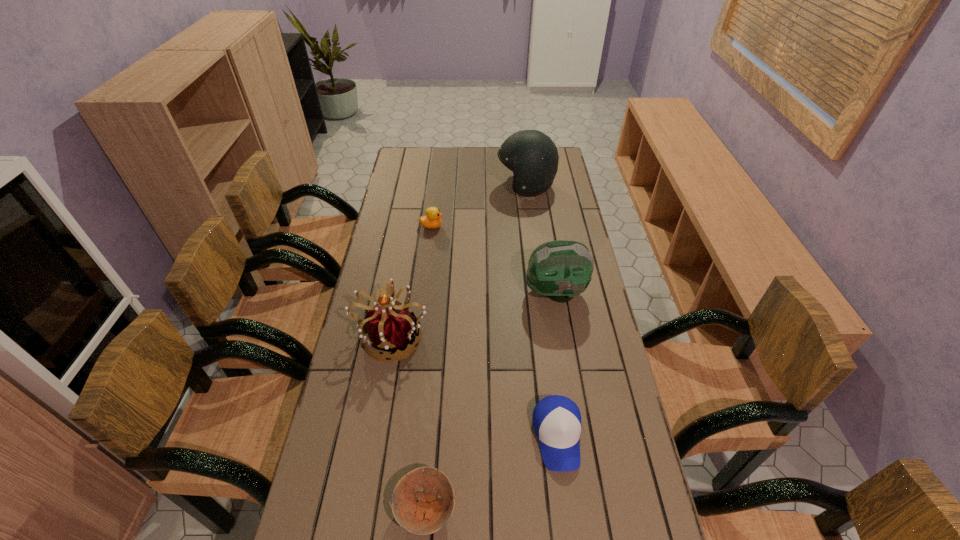
Locate an element on the screen. Image resolution: width=960 pixels, height=540 pixels. vacant region at the far edge of the desktop is located at coordinates (495, 164).

Locate an element on the screen. The image size is (960, 540). blank space at the left edge of the desktop is located at coordinates (375, 280).

Locate an element on the screen. Image resolution: width=960 pixels, height=540 pixels. vacant space at the right edge of the desktop is located at coordinates (553, 211).

Locate an element on the screen. empty space that is in between the tiara and the taller football helmet is located at coordinates (459, 261).

This screenshot has width=960, height=540. Find the location of `vacant point located between the farthest object and the second nearest object`. vacant point located between the farthest object and the second nearest object is located at coordinates (541, 311).

Where is `free spot between the baseball cap and the fifth nearest object`? The image size is (960, 540). free spot between the baseball cap and the fifth nearest object is located at coordinates (494, 332).

The width and height of the screenshot is (960, 540). In order to click on unoccupied area between the tiara and the farther football helmet in this screenshot , I will do `click(459, 261)`.

Locate an element on the screen. This screenshot has width=960, height=540. free area in between the tiara and the duckling is located at coordinates (412, 281).

This screenshot has height=540, width=960. Find the location of `free space between the tiara and the nearer football helmet`. free space between the tiara and the nearer football helmet is located at coordinates [x=474, y=314].

Where is `vacant space that is in between the tiara and the baseball cap`? The image size is (960, 540). vacant space that is in between the tiara and the baseball cap is located at coordinates (475, 386).